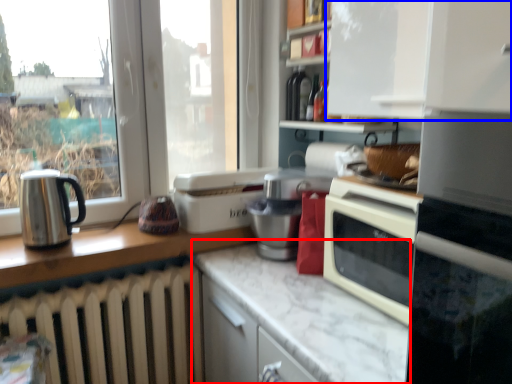
Question: Which of the following is the closest to the observer, counter top (highlighted by a red box) or cabinetry (highlighted by a blue box)?

Choices:
 (A) counter top
 (B) cabinetry

Answer: (A)